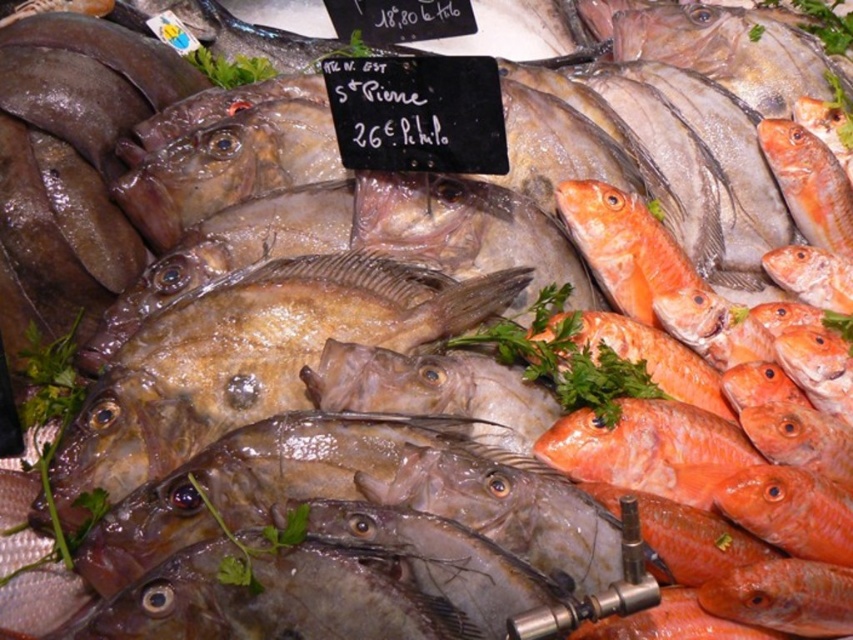
You are a customer at the fish market and want to pick up the fish closest to you. Which point should you reach for, point (659, 228) or point (567, 369)?

Point (659, 228) is further to the camera than point (567, 369), so you should reach for point (567, 369) since it is closer to you.

You are a customer at the fish market and want to pick up the shiny orange fish at center. However, there is green leafy parsley at center in the way. Can you reach the fish without moving the parsley?

The shiny orange fish at center is further to the viewer than green leafy parsley at center, so you can reach the shiny orange fish at center without moving the green leafy parsley at center because it is closer to you.

Based on the photo, you are a customer at the fish market and want to know the distance between the shiny orange fish at center and the green leafy parsley at center. Can you tell me how far apart they are?

The shiny orange fish at center is 6.50 inches from green leafy parsley at center.